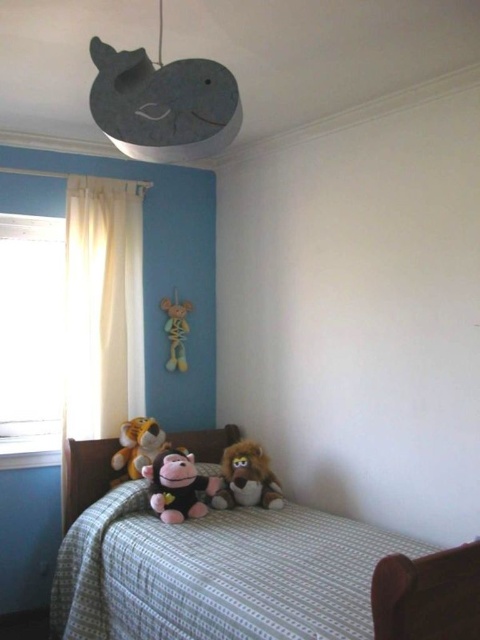
Measure the distance between white sheer curtain at left and camera.

white sheer curtain at left is 3.02 meters from camera.

Who is more distant from viewer, (123, 202) or (180, 360)?

The point (180, 360) is more distant.

Who is more distant from viewer, (105, 241) or (183, 364)?

Point (183, 364)

You are a GUI agent. You are given a task and a screenshot of the screen. Output one action in this format:
    pyautogui.click(x=<x>, y=<y>)
    Task: Click on the white sheer curtain at left
    This screenshot has height=640, width=480.
    Given the screenshot: What is the action you would take?
    pyautogui.click(x=103, y=307)

Between soft plush lion at center and soft plush tiger at center, which one is positioned lower?

soft plush lion at center is lower down.

Can you confirm if soft plush lion at center is smaller than soft plush tiger at center?

Incorrect, soft plush lion at center is not smaller in size than soft plush tiger at center.

At what (x,y) coordinates should I click in order to perform the action: click on soft plush lion at center. Please return your answer as a coordinate pair (x, y). Image resolution: width=480 pixels, height=640 pixels. Looking at the image, I should click on (247, 477).

From the picture: Can you confirm if black plush monkey at center is thinner than soft plush tiger at center?

In fact, black plush monkey at center might be wider than soft plush tiger at center.

Which of these two, black plush monkey at center or soft plush tiger at center, stands shorter?

With less height is black plush monkey at center.

Which is behind, point (205, 512) or point (121, 442)?

The point (121, 442) is more distant.

Identify the location of black plush monkey at center. (178, 486).